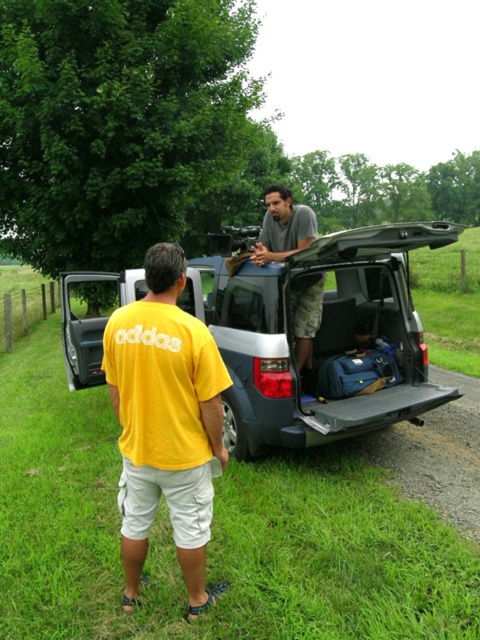
Consider the image. Is yellow cotton shirt at center thinner than gray cotton shirt at center?

Yes.

Is yellow cotton shirt at center to the left of gray cotton shirt at center from the viewer's perspective?

Correct, you'll find yellow cotton shirt at center to the left of gray cotton shirt at center.

The width and height of the screenshot is (480, 640). Find the location of `yellow cotton shirt at center`. yellow cotton shirt at center is located at coordinates (166, 420).

Who is higher up, satin silver jeep at center or gray cotton shirt at center?

gray cotton shirt at center is above.

What are the coordinates of `satin silver jeep at center` in the screenshot? It's located at (319, 337).

You are a GUI agent. You are given a task and a screenshot of the screen. Output one action in this format:
    pyautogui.click(x=<x>, y=<y>)
    Task: Click on the satin silver jeep at center
    The width and height of the screenshot is (480, 640).
    Given the screenshot: What is the action you would take?
    tap(319, 337)

From the picture: Is satin silver jeep at center smaller than yellow cotton shirt at center?

No.

Is point (272, 307) positioned after point (167, 289)?

That is True.

Describe the element at coordinates (319, 337) in the screenshot. I see `satin silver jeep at center` at that location.

Find the location of a particular element. The image size is (480, 640). satin silver jeep at center is located at coordinates (319, 337).